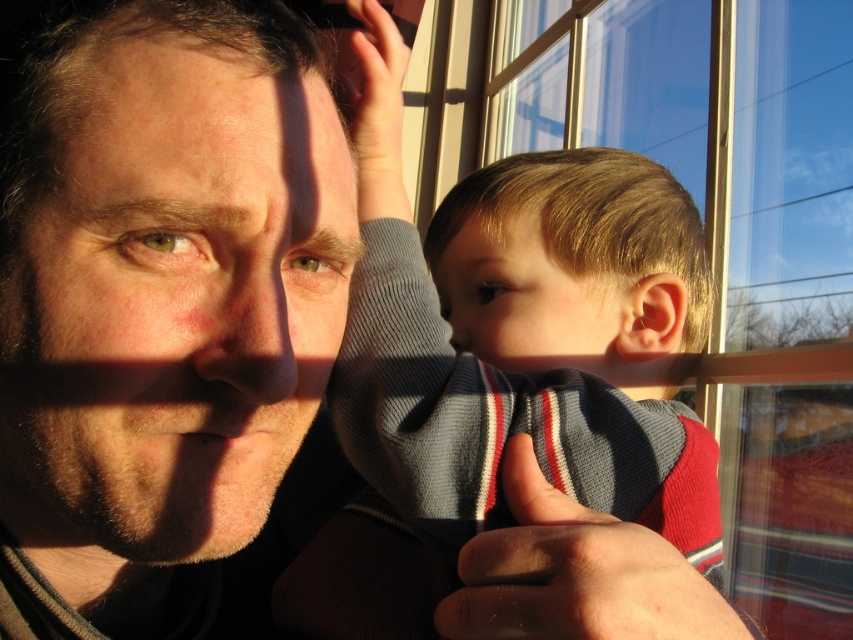
Question: Which object appears farthest from the camera in this image?

Choices:
 (A) clear glass window at upper center
 (B) smooth skin face at center

Answer: (A)

Question: Which of the following is the closest to the observer?

Choices:
 (A) smooth skin face at center
 (B) clear glass window at upper center

Answer: (A)

Question: Which point is farther from the camera taking this photo?

Choices:
 (A) (74, 307)
 (B) (728, 202)
 (C) (376, 333)

Answer: (B)

Question: Can you confirm if smooth skin face at center is positioned above clear glass window at upper center?

Choices:
 (A) no
 (B) yes

Answer: (A)

Question: Is smooth skin face at center below striped knit sweater at center?

Choices:
 (A) no
 (B) yes

Answer: (B)

Question: In this image, where is smooth skin face at center located relative to striped knit sweater at center?

Choices:
 (A) right
 (B) left

Answer: (B)